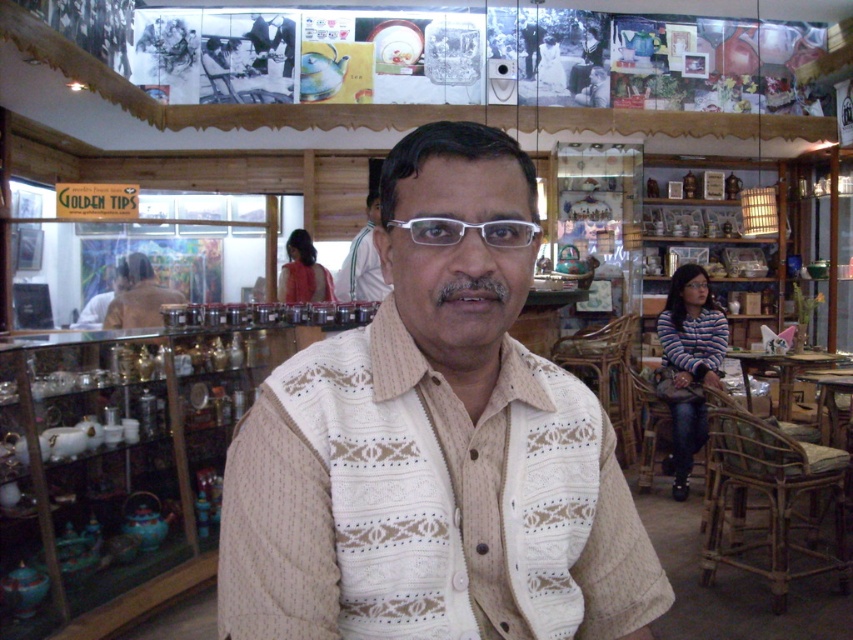
Question: Can you confirm if clear plastic glasses at center is positioned to the left of white textured shirt at center?

Choices:
 (A) yes
 (B) no

Answer: (B)

Question: Considering the real-world distances, which object is farthest from the white textured shirt at center?

Choices:
 (A) clear plastic glasses at center
 (B) brown fabric shirt at center

Answer: (A)

Question: Which object appears farthest from the camera in this image?

Choices:
 (A) white knitted sweater at center
 (B) white textured shirt at center
 (C) clear plastic glasses at center

Answer: (B)

Question: Does brown fabric shirt at center come behind white textured shirt at center?

Choices:
 (A) yes
 (B) no

Answer: (A)

Question: Which object appears closest to the camera in this image?

Choices:
 (A) clear plastic glasses at center
 (B) white knitted sweater at center
 (C) white textured shirt at center
 (D) brown fabric shirt at center

Answer: (B)

Question: Is clear plastic glasses at center below white textured shirt at center?

Choices:
 (A) no
 (B) yes

Answer: (B)